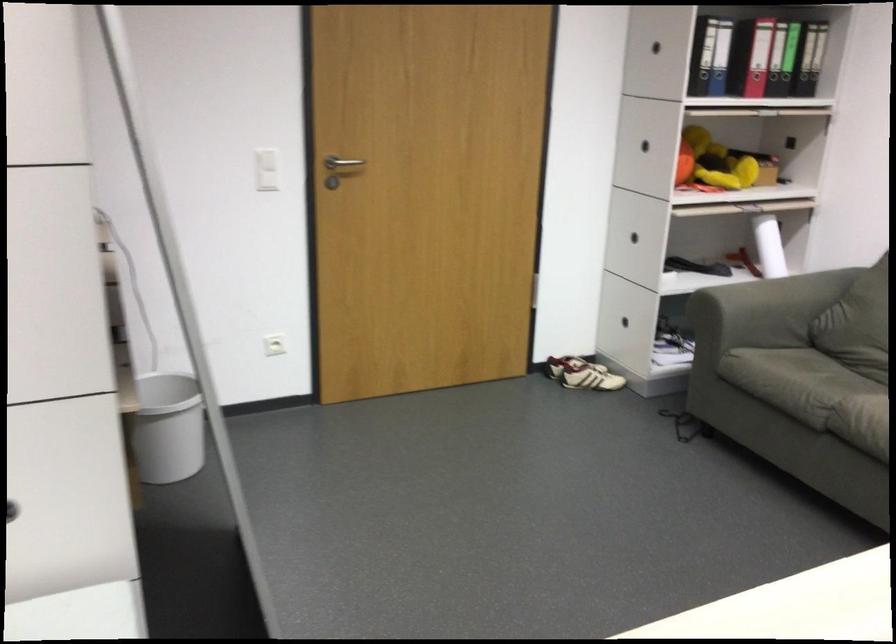
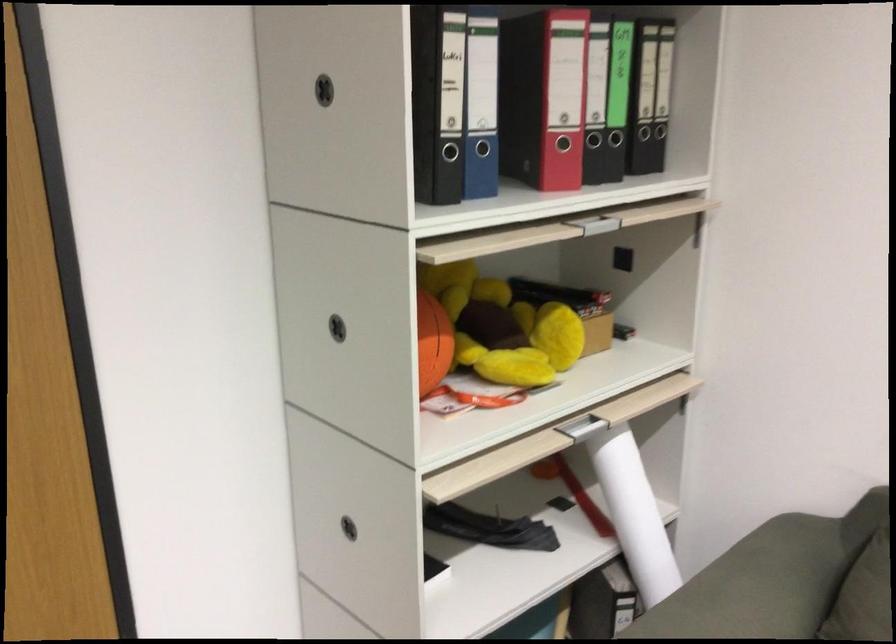
Locate, in the second image, the point that corresponds to point 754,95 in the first image.

(573, 219)